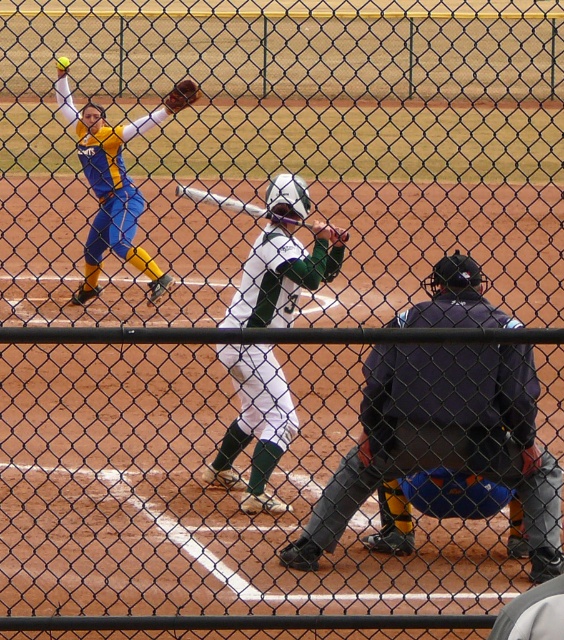
Is dark blue padded jacket at center in front of brown leather glove at center?

Yes, it is.

Does dark blue padded jacket at center have a greater width compared to brown leather glove at center?

Correct, the width of dark blue padded jacket at center exceeds that of brown leather glove at center.

At what (x,y) coordinates should I click in order to perform the action: click on dark blue padded jacket at center. Please return your answer as a coordinate pair (x, y). Looking at the image, I should click on (444, 440).

Looking at this image, between dark blue padded jacket at center and yellow matte baseball at upper left, which one is positioned lower?

dark blue padded jacket at center is below.

Is point (526, 452) closer to viewer compared to point (58, 65)?

Yes, point (526, 452) is closer to viewer.

Is point (522, 362) positioned after point (59, 67)?

No, (522, 362) is closer to viewer.

Where is `dark blue padded jacket at center`? dark blue padded jacket at center is located at coordinates (444, 440).

Does dark blue padded jacket at center appear on the left side of metallic silver bat at center?

Incorrect, dark blue padded jacket at center is not on the left side of metallic silver bat at center.

Which is more to the right, dark blue padded jacket at center or metallic silver bat at center?

From the viewer's perspective, dark blue padded jacket at center appears more on the right side.

Find the location of a particular element. dark blue padded jacket at center is located at coordinates (444, 440).